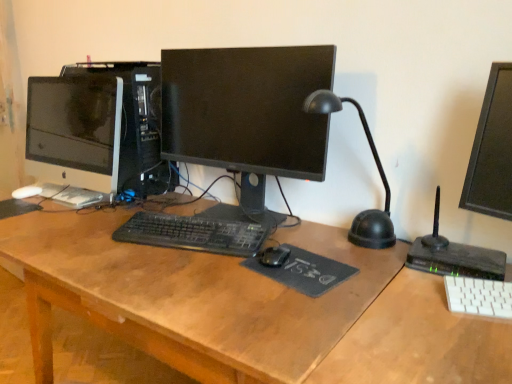
The height and width of the screenshot is (384, 512). In order to click on vacant space situated on the left part of black fabric mousepad at center, placed as the 2th mousepad when sorted from left to right in this screenshot , I will do `click(213, 274)`.